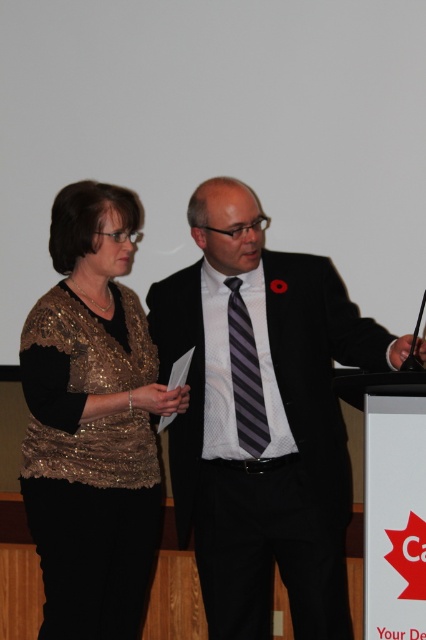
Question: Which point is farther to the camera?

Choices:
 (A) black suit at center
 (B) gold sequined vest at left
 (C) striped fabric tie at center

Answer: (C)

Question: Based on their relative distances, which object is farther from the gold sequined vest at left?

Choices:
 (A) striped fabric tie at center
 (B) black suit at center

Answer: (A)

Question: Does gold sequined vest at left have a lesser width compared to striped fabric tie at center?

Choices:
 (A) no
 (B) yes

Answer: (A)

Question: Which of the following is the closest to the observer?

Choices:
 (A) (327, 608)
 (B) (232, 365)

Answer: (B)

Question: Can you confirm if black suit at center is thinner than striped fabric tie at center?

Choices:
 (A) yes
 (B) no

Answer: (B)

Question: Is black suit at center to the right of gold sequined vest at left from the viewer's perspective?

Choices:
 (A) no
 (B) yes

Answer: (B)